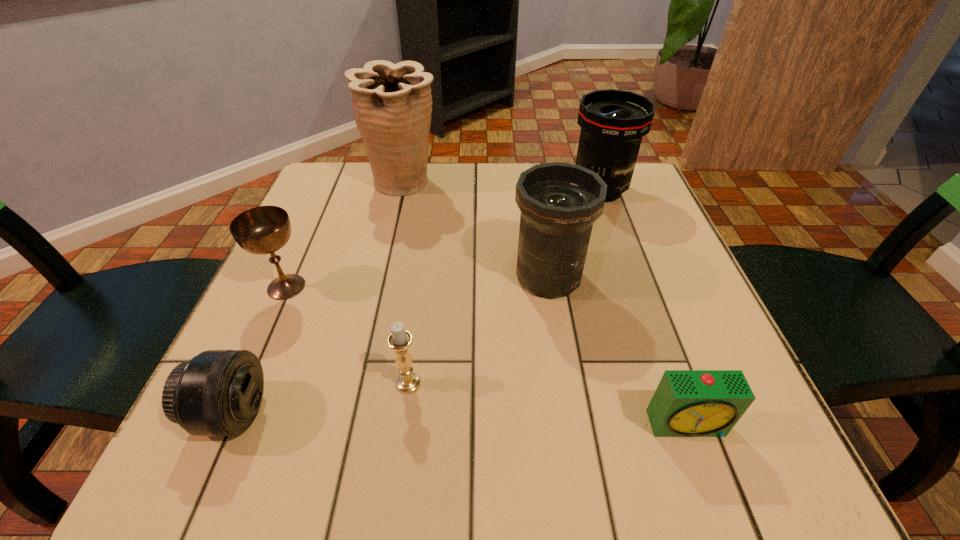
Locate an element on the screen. The width and height of the screenshot is (960, 540). urn is located at coordinates (392, 103).

At what (x,y) coordinates should I click in order to perform the action: click on the farthest telephoto lens. Please return your answer as a coordinate pair (x, y). This screenshot has height=540, width=960. Looking at the image, I should click on (613, 122).

Identify the location of the third object from right to left. The width and height of the screenshot is (960, 540). (559, 202).

The image size is (960, 540). Find the location of `the second telephoto lens from right to left`. the second telephoto lens from right to left is located at coordinates (559, 202).

The height and width of the screenshot is (540, 960). I want to click on chalice, so click(x=261, y=230).

Identify the location of candle holder. The height and width of the screenshot is (540, 960). (399, 340).

This screenshot has height=540, width=960. In order to click on the nearest telephoto lens in this screenshot , I will do `click(218, 392)`.

Identify the location of the shortest telephoto lens. (218, 392).

What are the coordinates of `alarm clock` in the screenshot? It's located at (687, 403).

At what (x,y) coordinates should I click in order to perform the action: click on vacant area situated 0.270m on the front of the urn. Please return your answer as a coordinate pair (x, y). The height and width of the screenshot is (540, 960). Looking at the image, I should click on (379, 285).